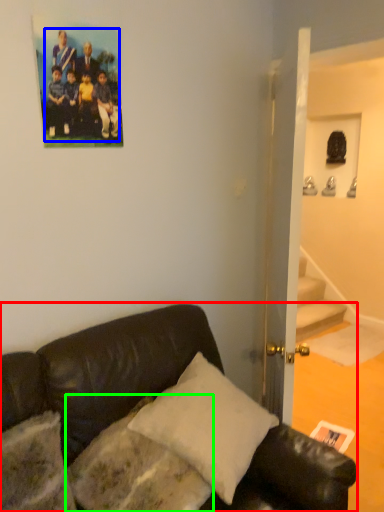
Question: Based on their relative distances, which object is nearer to studio couch (highlighted by a red box)? Choose from football team (highlighted by a blue box) and pillow (highlighted by a green box).

Choices:
 (A) football team
 (B) pillow

Answer: (B)